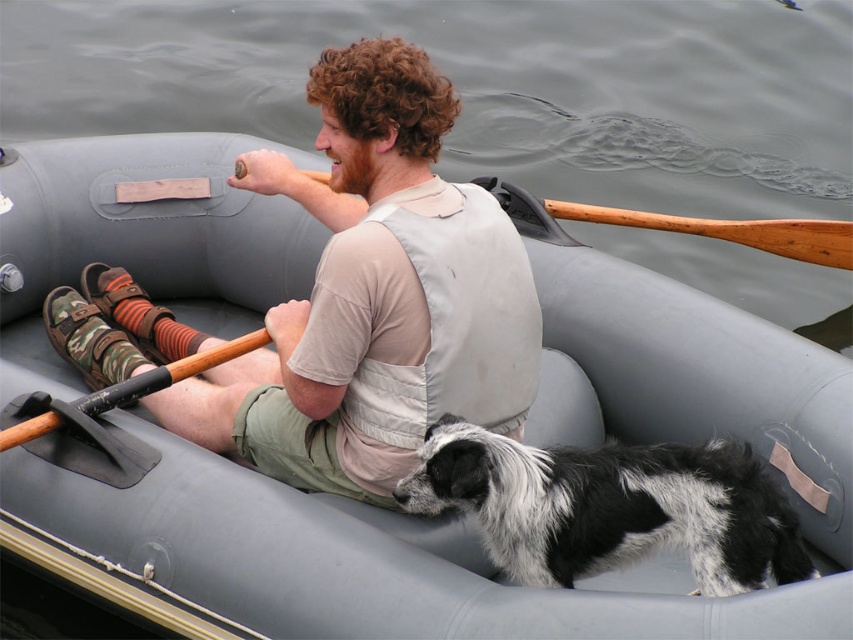
In the scene shown: You are a passenger on the gray inflatable boat and want to pet the black and white fur dog at center. To reach it, you need to move past the wooden paddle at upper center. Is the dog below or above the paddle?

The black and white fur dog at center is located below the wooden paddle at upper center, so the dog is below the paddle.